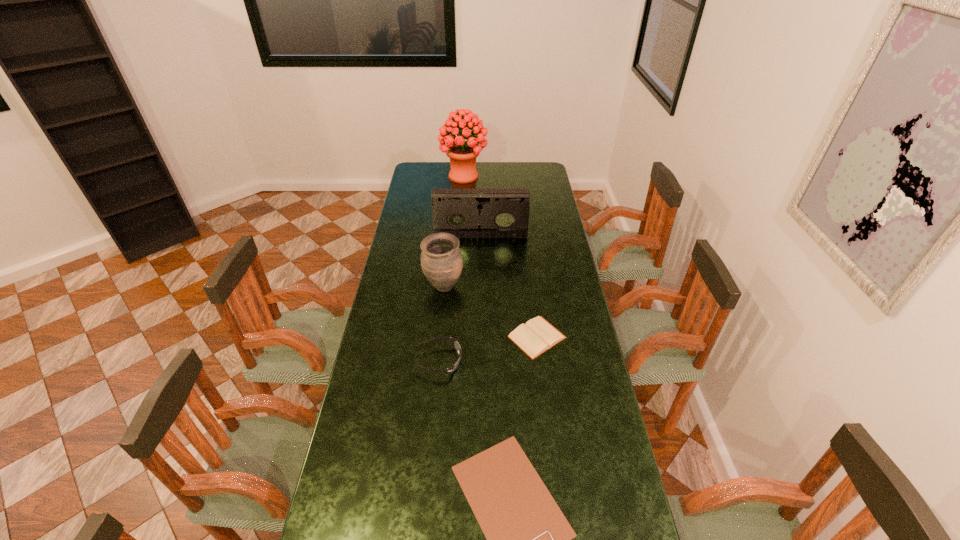
The height and width of the screenshot is (540, 960). What are the coordinates of `vacant space in between the diary and the urn` in the screenshot? It's located at (491, 312).

The image size is (960, 540). Identify the location of empty space that is in between the farthest object and the fifth tallest object. (500, 256).

Where is `the closest object to the fifth nearest object`? the closest object to the fifth nearest object is located at coordinates (441, 260).

Locate an element on the screen. This screenshot has width=960, height=540. the fourth closest object to the diary is located at coordinates (465, 213).

You are a GUI agent. You are given a task and a screenshot of the screen. Output one action in this format:
    pyautogui.click(x=<x>, y=<y>)
    Task: Click on the vacant area that satisfies the following two spatial constraints: 1. on the front side of the fifth nearest object; 2. on the lenses of the sunglasses
    The width and height of the screenshot is (960, 540).
    Given the screenshot: What is the action you would take?
    pyautogui.click(x=481, y=361)

Find the location of a particular element. free space that satisfies the following two spatial constraints: 1. on the front side of the videotape; 2. on the lenses of the third shortest object is located at coordinates (481, 361).